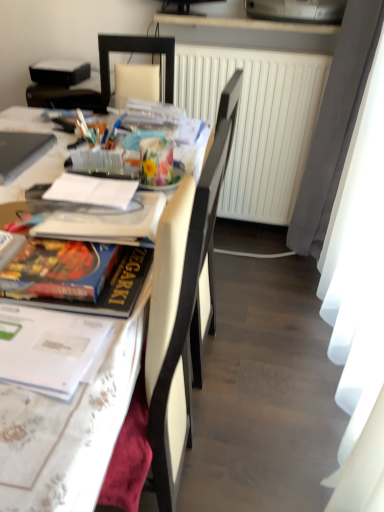
Question: Considering their positions, is white paper at center located in front of or behind matte silver laptop at upper left?

Choices:
 (A) behind
 (B) front

Answer: (B)

Question: Considering the positions of point (92, 198) and point (4, 137), is point (92, 198) closer or farther from the camera than point (4, 137)?

Choices:
 (A) farther
 (B) closer

Answer: (B)

Question: Which is nearer to the white glossy table at left?

Choices:
 (A) floral-patterned paper at center
 (B) white paper at center
 (C) matte silver laptop at upper left
 (D) metallic silver printer at upper center
 (E) white leather chair at center

Answer: (C)

Question: Estimate the real-world distances between objects in this image. Which object is farther from the black matte projector at upper left, the 1th magazine in the top-to-bottom sequence?

Choices:
 (A) matte silver laptop at upper left
 (B) white paper at center
 (C) floral-patterned paper at center
 (D) white matte radiator at center
 (E) white glossy table at left

Answer: (B)